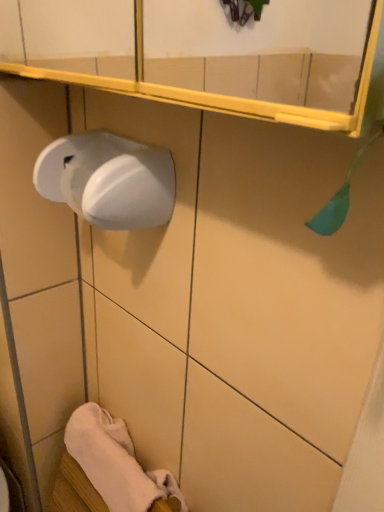
Question: Can you confirm if white soft towel at lower left is positioned to the right of white glossy paper towel at left?

Choices:
 (A) no
 (B) yes

Answer: (A)

Question: From the image's perspective, is white soft towel at lower left below white glossy paper towel at left?

Choices:
 (A) no
 (B) yes

Answer: (B)

Question: Would you say white soft towel at lower left contains white glossy paper towel at left?

Choices:
 (A) yes
 (B) no

Answer: (B)

Question: From a real-world perspective, is white soft towel at lower left beneath white glossy paper towel at left?

Choices:
 (A) yes
 (B) no

Answer: (A)

Question: Is the position of white soft towel at lower left less distant than that of white glossy paper towel at left?

Choices:
 (A) no
 (B) yes

Answer: (A)

Question: Is white soft towel at lower left positioned far away from white glossy paper towel at left?

Choices:
 (A) no
 (B) yes

Answer: (A)

Question: Is white glossy soap dispenser at left inside white soft towel at lower left?

Choices:
 (A) no
 (B) yes

Answer: (A)

Question: Is white soft towel at lower left positioned beyond the bounds of white glossy soap dispenser at left?

Choices:
 (A) no
 (B) yes

Answer: (B)

Question: Does white soft towel at lower left have a smaller size compared to white glossy soap dispenser at left?

Choices:
 (A) no
 (B) yes

Answer: (B)

Question: Considering the relative sizes of white soft towel at lower left and white glossy soap dispenser at left in the image provided, is white soft towel at lower left bigger than white glossy soap dispenser at left?

Choices:
 (A) no
 (B) yes

Answer: (A)

Question: From a real-world perspective, is white soft towel at lower left under white glossy soap dispenser at left?

Choices:
 (A) no
 (B) yes

Answer: (B)

Question: From the image's perspective, is white soft towel at lower left above white glossy soap dispenser at left?

Choices:
 (A) yes
 (B) no

Answer: (B)

Question: From the image's perspective, does white glossy soap dispenser at left appear lower than white soft towel at lower left?

Choices:
 (A) no
 (B) yes

Answer: (A)